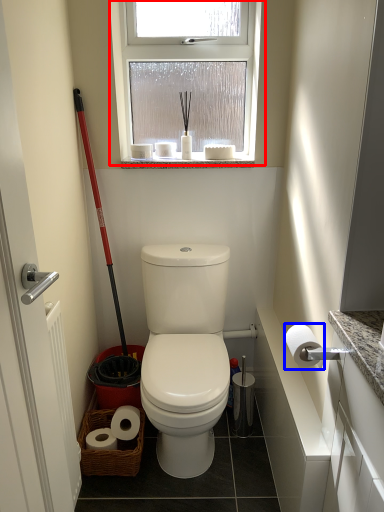
Question: Which object appears farthest to the camera in this image, window (highlighted by a red box) or toilet paper (highlighted by a blue box)?

Choices:
 (A) window
 (B) toilet paper

Answer: (A)